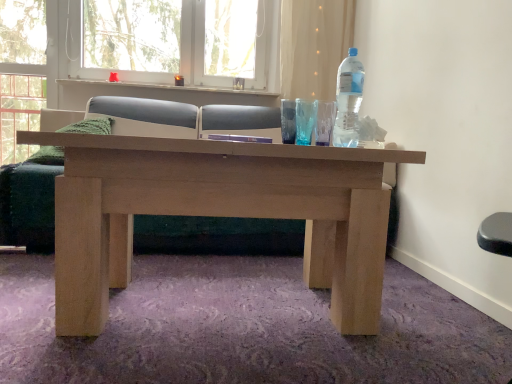
Question: Can you confirm if white plastic window frame at upper center is positioned to the right of matte wood couch at center?

Choices:
 (A) no
 (B) yes

Answer: (A)

Question: Is white plastic window frame at upper center outside matte wood couch at center?

Choices:
 (A) yes
 (B) no

Answer: (A)

Question: From a real-world perspective, is white plastic window frame at upper center on matte wood couch at center?

Choices:
 (A) no
 (B) yes

Answer: (B)

Question: Is white plastic window frame at upper center thinner than matte wood couch at center?

Choices:
 (A) yes
 (B) no

Answer: (A)

Question: Is white plastic window frame at upper center at the left side of matte wood couch at center?

Choices:
 (A) yes
 (B) no

Answer: (A)

Question: Is white plastic window frame at upper center wider than matte wood couch at center?

Choices:
 (A) no
 (B) yes

Answer: (A)

Question: Considering the relative sizes of translucent fabric curtain at upper center and transparent plastic bottle at upper right in the image provided, is translucent fabric curtain at upper center taller than transparent plastic bottle at upper right?

Choices:
 (A) yes
 (B) no

Answer: (A)

Question: Is translucent fabric curtain at upper center to the right of transparent plastic bottle at upper right from the viewer's perspective?

Choices:
 (A) no
 (B) yes

Answer: (B)

Question: Is translucent fabric curtain at upper center shorter than transparent plastic bottle at upper right?

Choices:
 (A) yes
 (B) no

Answer: (B)

Question: Could you tell me if translucent fabric curtain at upper center is turned towards transparent plastic bottle at upper right?

Choices:
 (A) no
 (B) yes

Answer: (B)

Question: Is transparent plastic bottle at upper right at the back of translucent fabric curtain at upper center?

Choices:
 (A) no
 (B) yes

Answer: (A)

Question: From the image's perspective, is translucent fabric curtain at upper center on top of transparent plastic bottle at upper right?

Choices:
 (A) no
 (B) yes

Answer: (B)

Question: From a real-world perspective, is translucent fabric curtain at upper center positioned under white plastic window frame at upper center based on gravity?

Choices:
 (A) no
 (B) yes

Answer: (B)